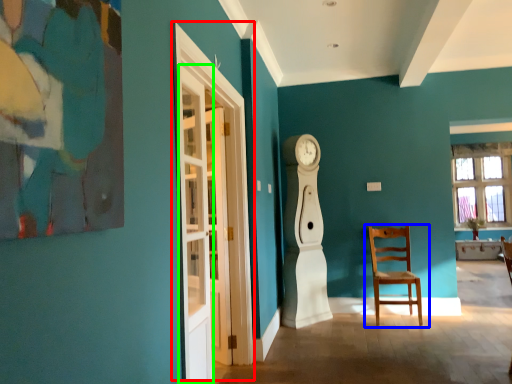
Question: Which is nearer to the glass door (highlighted by a red box)? chair (highlighted by a blue box) or glass door (highlighted by a green box).

Choices:
 (A) chair
 (B) glass door

Answer: (B)